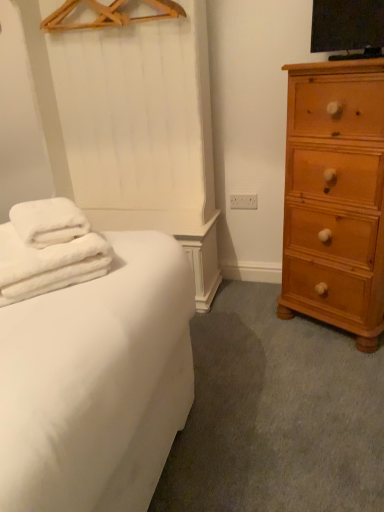
Question: Is wooden hanger at upper center bigger or smaller than white fluffy towels at left?

Choices:
 (A) small
 (B) big

Answer: (A)

Question: Would you say wooden hanger at upper center is to the left or to the right of white fluffy towels at left in the picture?

Choices:
 (A) right
 (B) left

Answer: (A)

Question: Based on their relative distances, which object is nearer to the wooden hanger at upper center?

Choices:
 (A) light brown wooden chest of drawers at right
 (B) white fluffy towels at left

Answer: (A)

Question: Which is nearer to the white fluffy towels at left?

Choices:
 (A) light brown wooden chest of drawers at right
 (B) wooden hanger at upper center

Answer: (A)